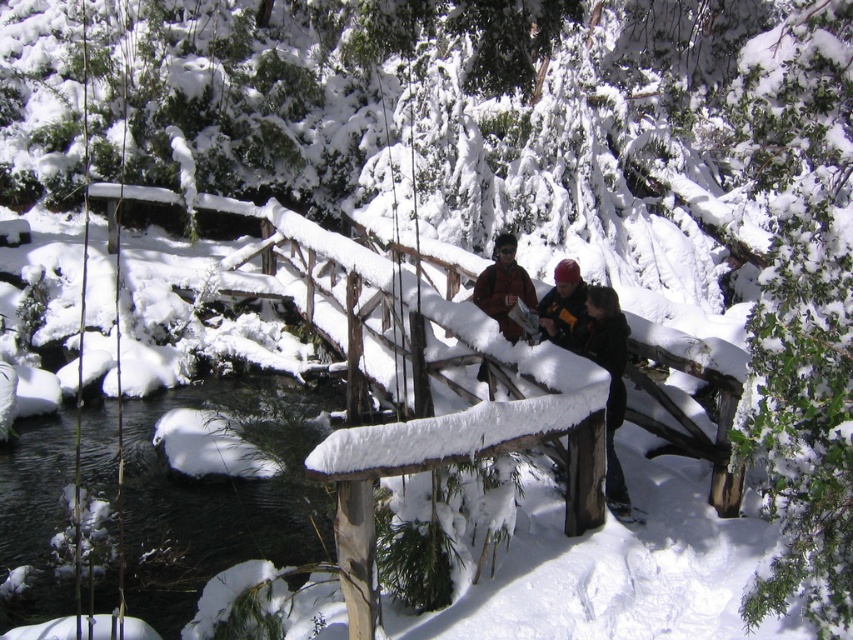
You are a hiker who has just arrived at the snowy bridge and see both the dark brown leather jacket at center and the black leather jacket at center. You need to choose one to wear for warmth. Which jacket should you pick based on their sizes?

The dark brown leather jacket at center is bigger than the black leather jacket at center, so it would provide more warmth and space for layering, making it the better choice.

From the picture: You are standing on the snow covered wooden bridge and see a black leather jacket at center and a matte black helmet at center. Which object is closer to you?

The black leather jacket at center is closer to you because it is in front of the matte black helmet at center.